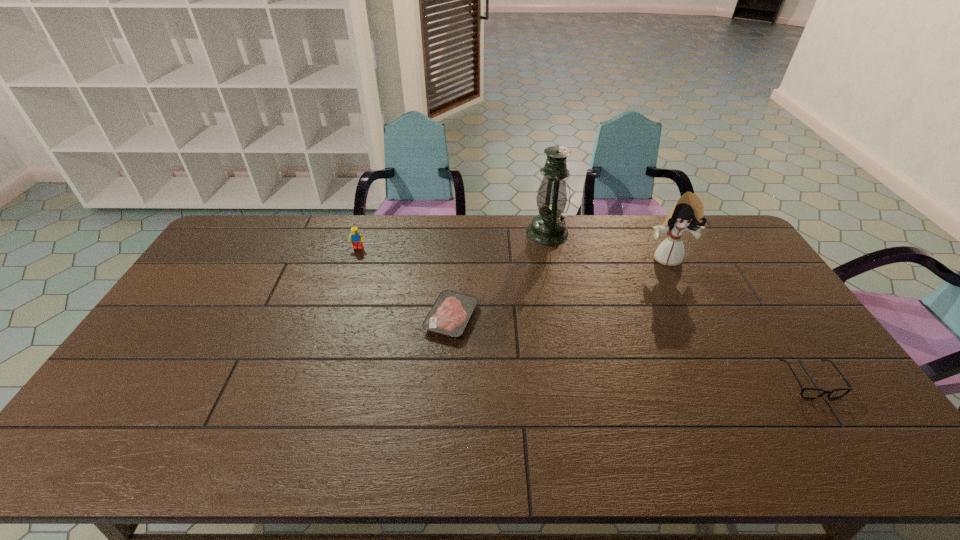
This screenshot has width=960, height=540. Identify the location of free space at the left edge of the desktop. (152, 404).

Where is `vacant space at the right edge of the desktop`? This screenshot has height=540, width=960. vacant space at the right edge of the desktop is located at coordinates (776, 334).

Where is `vacant space at the far left corner of the desktop`? The width and height of the screenshot is (960, 540). vacant space at the far left corner of the desktop is located at coordinates (242, 224).

Locate an element on the screen. This screenshot has width=960, height=540. free point between the fourth tallest object and the second nearest object is located at coordinates pos(631,349).

Identify the location of free space between the tallest object and the leftmost object. The image size is (960, 540). (453, 240).

Find the location of `free space between the fourth shortest object and the third shortest object`. free space between the fourth shortest object and the third shortest object is located at coordinates (513, 253).

Where is `free point between the Lego and the fourth shortest object`? The width and height of the screenshot is (960, 540). free point between the Lego and the fourth shortest object is located at coordinates (513, 253).

Identify the location of vacant point located between the second object from right to left and the third object from left to right. (607, 245).

The image size is (960, 540). In order to click on unoccupied area between the third tallest object and the steak in this screenshot , I will do `click(405, 283)`.

You are a GUI agent. You are given a task and a screenshot of the screen. Output one action in this format:
    pyautogui.click(x=<x>, y=<y>)
    Task: Click on the vacant space that is in between the second object from left to right and the rightmost object
    The height and width of the screenshot is (540, 960).
    Given the screenshot: What is the action you would take?
    pyautogui.click(x=631, y=349)